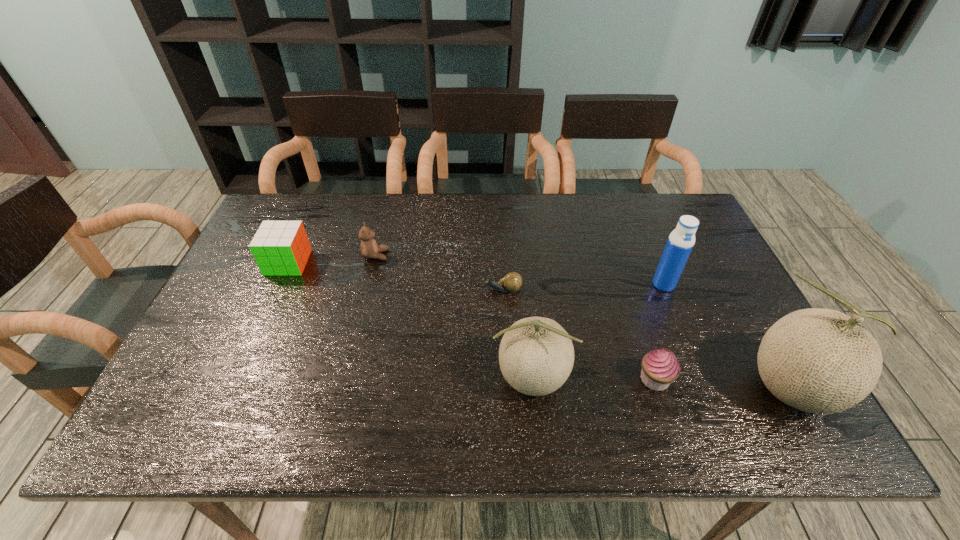
At what (x,y) coordinates should I click in order to perform the action: click on vacant region between the escargot and the sixth object from left to right. Please return your answer as a coordinate pair (x, y). Looking at the image, I should click on (583, 287).

I want to click on free space that is in between the cube and the second object from left to right, so click(332, 259).

You are a GUI agent. You are given a task and a screenshot of the screen. Output one action in this format:
    pyautogui.click(x=<x>, y=<y>)
    Task: Click on the free space between the shortest object and the water bottle
    The height and width of the screenshot is (540, 960).
    Given the screenshot: What is the action you would take?
    pyautogui.click(x=583, y=287)

Image resolution: width=960 pixels, height=540 pixels. I want to click on vacant space that is in between the leftmost object and the second object from left to right, so click(x=332, y=259).

Locate an element on the screen. unoccupied area between the sixth object from right to left and the left cantaloup is located at coordinates (453, 317).

You are a GUI agent. You are given a task and a screenshot of the screen. Output one action in this format:
    pyautogui.click(x=<x>, y=<y>)
    Task: Click on the vacant area that lies between the leftmost object and the shorter cantaloup
    
    Given the screenshot: What is the action you would take?
    pyautogui.click(x=409, y=321)

Identify which object is located as the fourth nearest to the escargot. Please provide its 2D coordinates. Your answer should be formatted as a tuple, i.e. [(x, y)], where the tuple contains the x and y coordinates of a point satisfying the conditions above.

[(680, 243)]

At what (x,y) coordinates should I click in order to perform the action: click on the third closest object relative to the sixth object from left to right. Please return your answer as a coordinate pair (x, y). The width and height of the screenshot is (960, 540). Looking at the image, I should click on tap(536, 355).

Identify the location of vacant region that satisfies the following two spatial constraints: 1. on the front-facing side of the teddy bear; 2. on the right side of the sixth object from left to right. (369, 284).

Identify the location of vacant space that satisfies the following two spatial constraints: 1. on the front-facing side of the right cantaloup; 2. on the right side of the teddy bear. This screenshot has width=960, height=540. (343, 388).